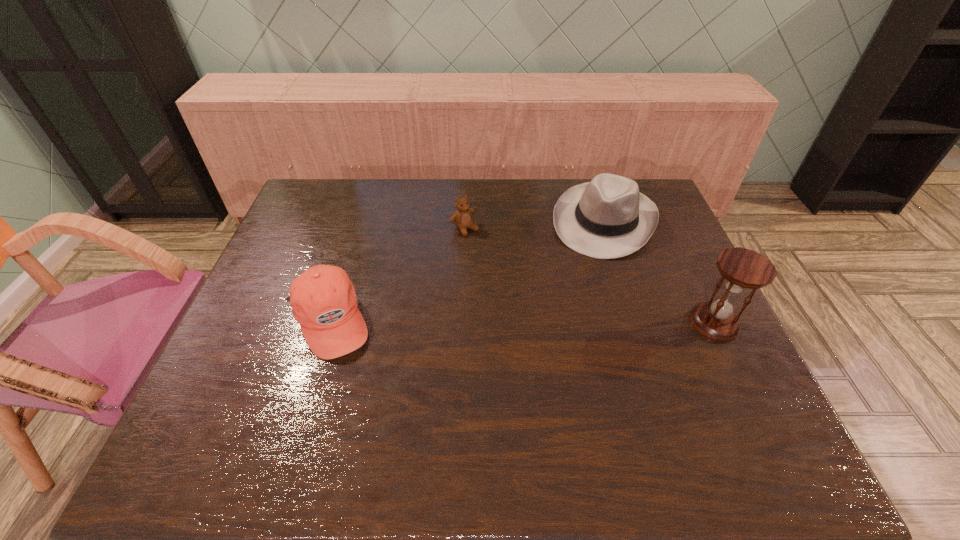
This screenshot has width=960, height=540. What are the coordinates of `vacant position at the near edge of the desktop` in the screenshot? It's located at (393, 396).

Where is `vacant space at the left edge`? vacant space at the left edge is located at coordinates (255, 339).

This screenshot has width=960, height=540. In the image, there is a desktop. Identify the location of vacant area at the right edge. tap(643, 282).

In the image, there is a desktop. Identify the location of blank space at the far left corner. This screenshot has width=960, height=540. (308, 188).

I want to click on free location at the near left corner of the desktop, so click(261, 409).

Where is `vacant space at the near right corner`? vacant space at the near right corner is located at coordinates (746, 390).

Find the location of a particular element. Image resolution: width=960 pixels, height=540 pixels. free spot between the tallest object and the teddy bear is located at coordinates (589, 276).

Where is `free spot between the tallest object and the fedora`? free spot between the tallest object and the fedora is located at coordinates (660, 272).

The width and height of the screenshot is (960, 540). I want to click on unoccupied position between the baseball cap and the fedora, so click(x=467, y=271).

Locate an element on the screen. This screenshot has height=540, width=960. blank region between the fedora and the leftmost object is located at coordinates (467, 271).